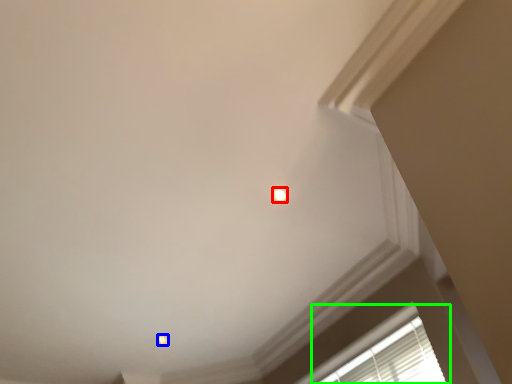
Question: Based on their relative distances, which object is nearer to dot (highlighted by a red box)? Choose from dot (highlighted by a blue box) and window (highlighted by a green box).

Choices:
 (A) dot
 (B) window

Answer: (B)